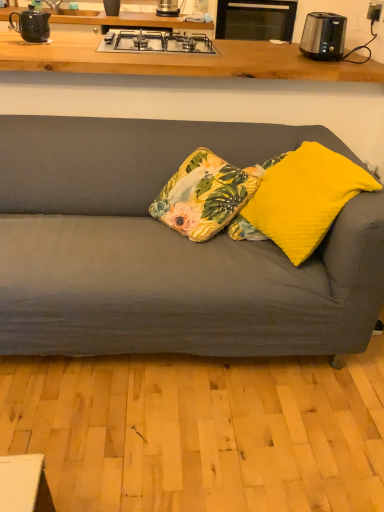
Identify the location of free space in front of polished stainless steel toaster at upper right, the first kitchen appliance when ordered from right to left. This screenshot has height=512, width=384. (346, 61).